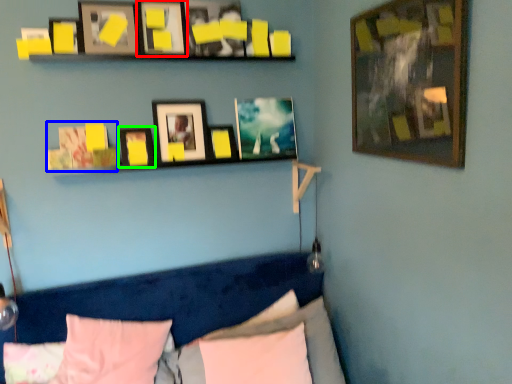
Question: Which object is positioned closest to picture frame (highlighted by a red box)? Select from picture frame (highlighted by a blue box) and picture frame (highlighted by a green box).

Choices:
 (A) picture frame
 (B) picture frame

Answer: (B)